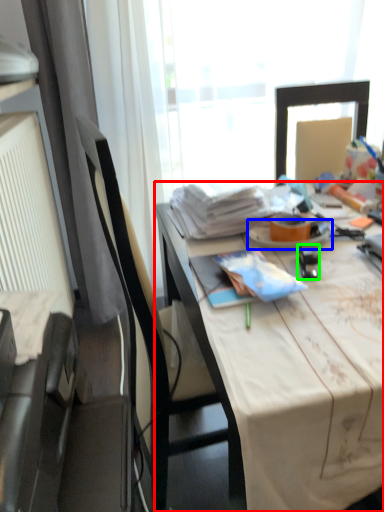
Question: Estimate the real-world distances between objects in this image. Which object is farther from desk (highlighted by a red box), plate (highlighted by a blue box) or stationery (highlighted by a green box)?

Choices:
 (A) plate
 (B) stationery

Answer: (A)